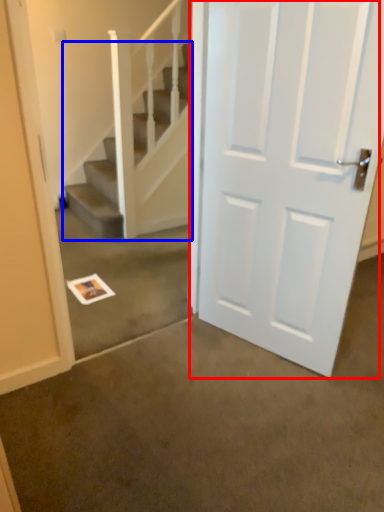
Question: Which object is further to the camera taking this photo, door (highlighted by a red box) or stairs (highlighted by a blue box)?

Choices:
 (A) door
 (B) stairs

Answer: (B)